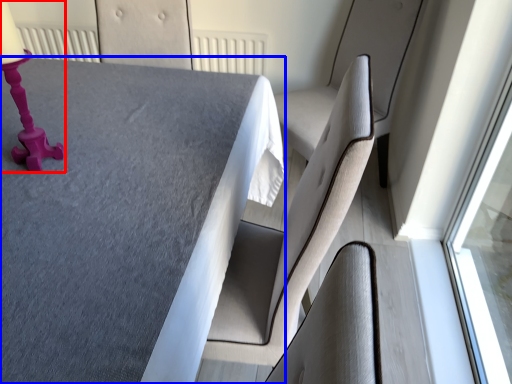
Question: Which point is further to the camera, table lamp (highlighted by a red box) or table (highlighted by a blue box)?

Choices:
 (A) table lamp
 (B) table

Answer: (A)